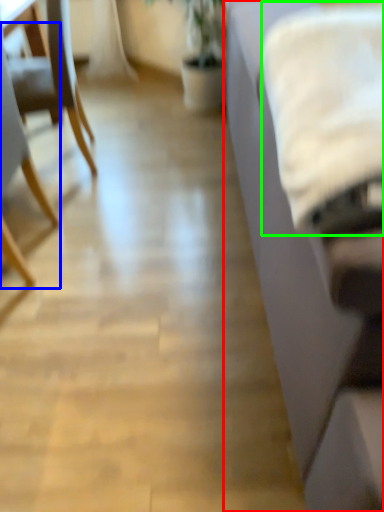
Question: Based on their relative distances, which object is nearer to studio couch (highlighted by a red box)? Choose from chair (highlighted by a blue box) and sheet (highlighted by a green box).

Choices:
 (A) chair
 (B) sheet

Answer: (B)